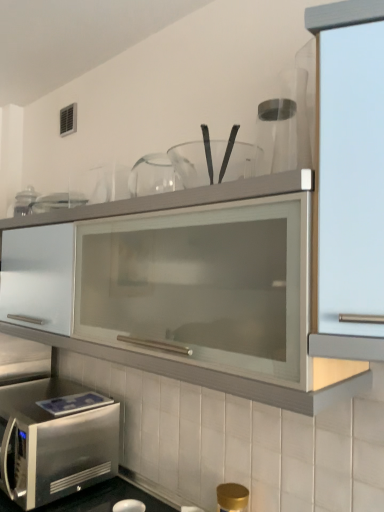
Question: Could you tell me if stainless steel microwave at lower left is facing satin glass cabinet at right?

Choices:
 (A) no
 (B) yes

Answer: (A)

Question: Considering the relative sizes of stainless steel microwave at lower left and satin glass cabinet at right in the image provided, is stainless steel microwave at lower left thinner than satin glass cabinet at right?

Choices:
 (A) no
 (B) yes

Answer: (A)

Question: Are stainless steel microwave at lower left and satin glass cabinet at right far apart?

Choices:
 (A) yes
 (B) no

Answer: (A)

Question: Can you confirm if stainless steel microwave at lower left is taller than satin glass cabinet at right?

Choices:
 (A) no
 (B) yes

Answer: (A)

Question: Is stainless steel microwave at lower left at the right side of satin glass cabinet at right?

Choices:
 (A) yes
 (B) no

Answer: (B)

Question: Looking at the image, does stainless steel microwave at lower left seem bigger or smaller compared to transparent glass jar at upper center?

Choices:
 (A) big
 (B) small

Answer: (A)

Question: In terms of height, does stainless steel microwave at lower left look taller or shorter compared to transparent glass jar at upper center?

Choices:
 (A) tall
 (B) short

Answer: (A)

Question: In the image, is stainless steel microwave at lower left positioned in front of or behind transparent glass jar at upper center?

Choices:
 (A) front
 (B) behind

Answer: (B)

Question: Considering the positions of stainless steel microwave at lower left and transparent glass jar at upper center in the image, is stainless steel microwave at lower left wider or thinner than transparent glass jar at upper center?

Choices:
 (A) wide
 (B) thin

Answer: (A)

Question: Considering their positions, is stainless steel microwave at lower left located in front of or behind satin glass cabinet at right?

Choices:
 (A) behind
 (B) front

Answer: (A)

Question: Is point (87, 445) closer or farther from the camera than point (322, 27)?

Choices:
 (A) farther
 (B) closer

Answer: (A)

Question: From a real-world perspective, is stainless steel microwave at lower left physically located above or below satin glass cabinet at right?

Choices:
 (A) above
 (B) below

Answer: (B)

Question: From the image's perspective, is stainless steel microwave at lower left positioned above or below satin glass cabinet at right?

Choices:
 (A) above
 (B) below

Answer: (B)

Question: Is satin glass cabinet at right in front of or behind transparent glass jar at upper center in the image?

Choices:
 (A) front
 (B) behind

Answer: (A)

Question: Considering the positions of satin glass cabinet at right and transparent glass jar at upper center in the image, is satin glass cabinet at right taller or shorter than transparent glass jar at upper center?

Choices:
 (A) short
 (B) tall

Answer: (B)